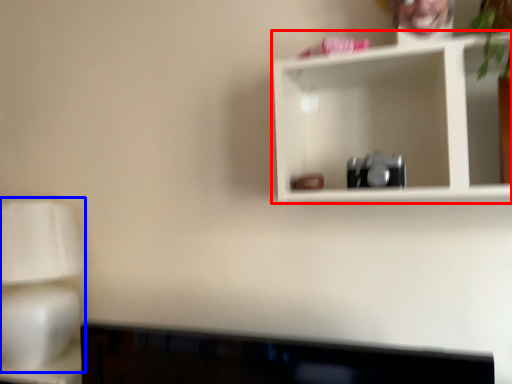
Question: Which object appears farthest to the camera in this image, shelf (highlighted by a red box) or table lamp (highlighted by a blue box)?

Choices:
 (A) shelf
 (B) table lamp

Answer: (B)